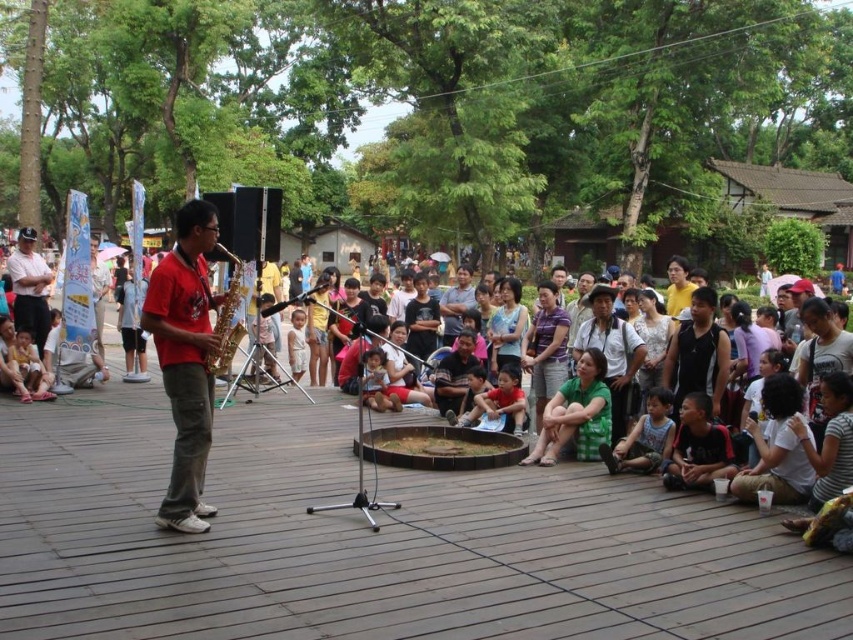
You are attending a park event and want to take a photo of the performer. The red matte saxophone at left and the matte black shirt at upper left are both in your camera frame. Which object will appear larger in your photo?

The red matte saxophone at left will appear larger in the photo because it is closer to the viewer than the matte black shirt at upper left.

In the scene shown: You are standing at the front of the stage and want to move to the saxophonist. There are two points marked on the stage floor labeled as point (334, 282) and point (221, 332). Which point should you walk towards to get closer to the saxophonist?

Point (221, 332) is closer to the saxophonist because it is in front of point (334, 282), which is behind it.

Consider the image. You are standing in the park and see the saxophonist on the stage. There is a point marked at coordinates (651, 342) in the image. What object or feature is located at that point?

The point at coordinates (651, 342) corresponds to the matte green clothing at center, which is part of the saxophonist performing on the stage.